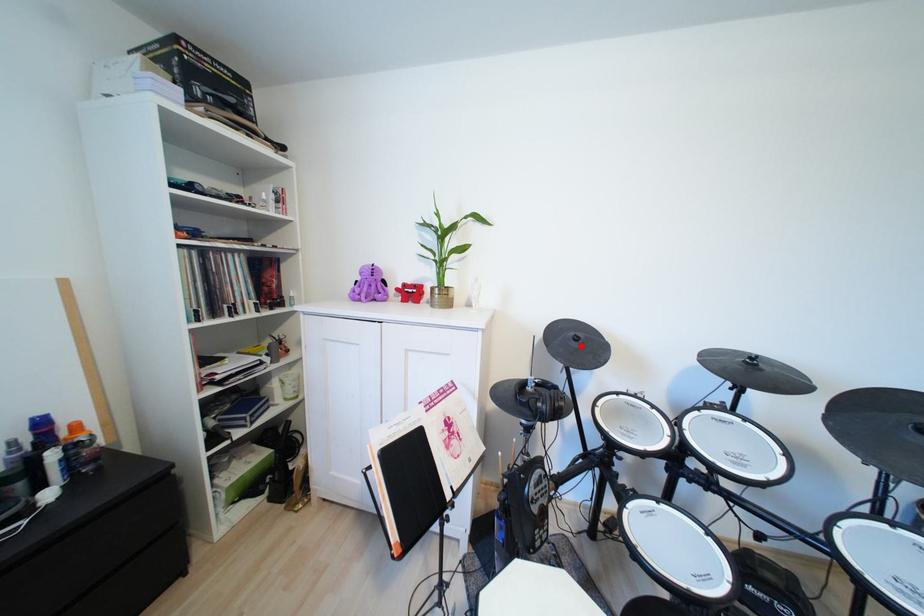
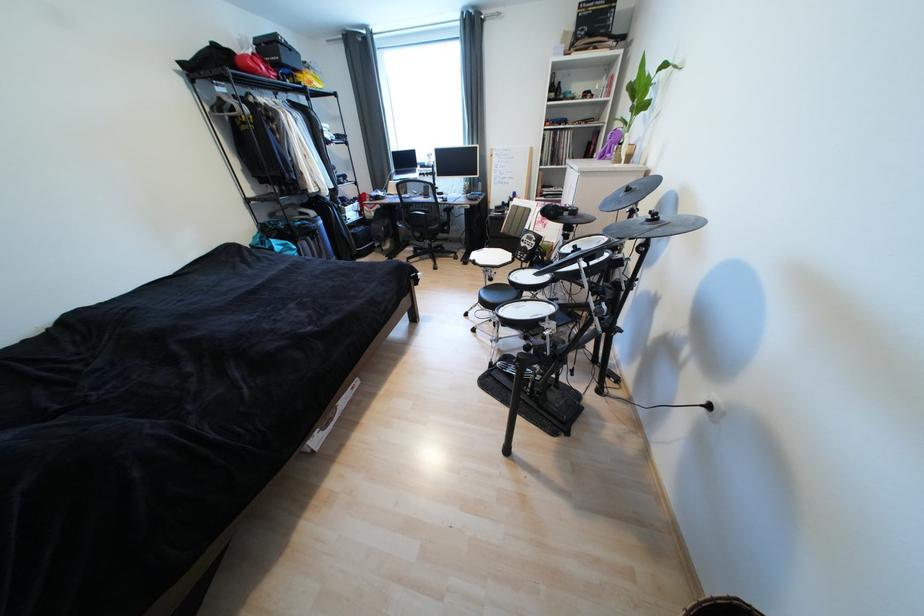
Locate, in the second image, the point that corresponds to the highlighted location in the first image.

(628, 196)